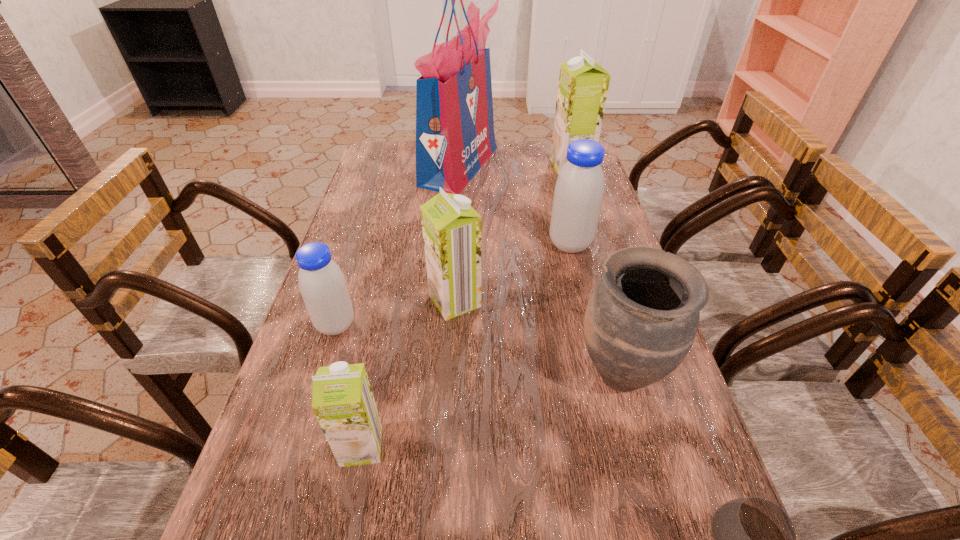
Image resolution: width=960 pixels, height=540 pixels. Find the location of `the left blue soya milk`. the left blue soya milk is located at coordinates (322, 284).

The height and width of the screenshot is (540, 960). What are the coordinates of `the second soya milk from left to right` in the screenshot? It's located at (342, 400).

The width and height of the screenshot is (960, 540). Identify the location of the second nearest object. (342, 400).

I want to click on vacant region located 0.330m on the front-facing side of the grocery bag, so click(x=590, y=166).

You are a GUI agent. You are given a task and a screenshot of the screen. Output one action in this format:
    pyautogui.click(x=<x>, y=<y>)
    Task: Click on the vacant space located 0.060m on the left of the farthest soya milk
    This screenshot has height=540, width=960.
    Given the screenshot: What is the action you would take?
    pyautogui.click(x=535, y=166)

The image size is (960, 540). Find the location of `vacant region located 0.100m on the right of the second farthest green soya milk`. vacant region located 0.100m on the right of the second farthest green soya milk is located at coordinates (521, 301).

Image resolution: width=960 pixels, height=540 pixels. In order to click on free spot located on the front of the right blue soya milk in this screenshot , I will do `click(593, 342)`.

Locate an element on the screen. This screenshot has width=960, height=540. vacant space situated on the left of the urn is located at coordinates (461, 373).

Image resolution: width=960 pixels, height=540 pixels. Find the location of `blank space located on the front of the leftmost object`. blank space located on the front of the leftmost object is located at coordinates (289, 474).

The image size is (960, 540). Identify the location of vacant space located 0.270m on the back of the fourth soya milk from right to left. (387, 320).